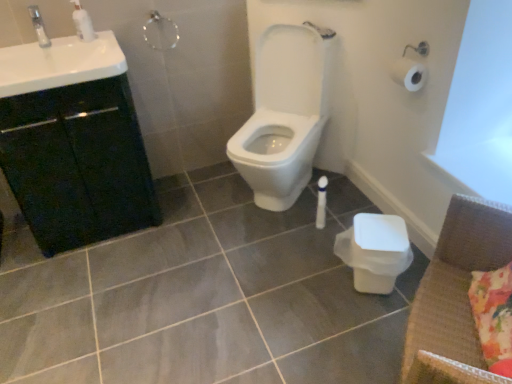
Where is `white glossy soap dispenser at upper left`? The width and height of the screenshot is (512, 384). white glossy soap dispenser at upper left is located at coordinates (82, 22).

Describe the element at coordinates (494, 316) in the screenshot. I see `fluffy floral pillow at lower right` at that location.

You are a GUI agent. You are given a task and a screenshot of the screen. Output one action in this format:
    pyautogui.click(x=<x>, y=<y>)
    Task: Click on the fluffy floral pillow at lower right
    
    Given the screenshot: What is the action you would take?
    click(494, 316)

This screenshot has height=384, width=512. What do you see at coordinates (375, 251) in the screenshot? I see `white plastic toilet bowl at lower right` at bounding box center [375, 251].

Locate an element on the screen. This screenshot has width=512, height=384. white plastic toilet bowl at lower right is located at coordinates (375, 251).

Image resolution: width=512 pixels, height=384 pixels. I want to click on brown woven armchair at lower right, so click(x=455, y=295).

Where is `white glossy toilet at center`? The width and height of the screenshot is (512, 384). white glossy toilet at center is located at coordinates (284, 114).

You are a GUI agent. You are given a task and a screenshot of the screen. Output one action in this format:
    pyautogui.click(x=<x>, y=<y>)
    Task: Click on the white glossy soap dispenser at upper left
    The image size is (512, 384).
    Given the screenshot: What is the action you would take?
    pyautogui.click(x=82, y=22)

What's the angular difference between black matte cabinet at left and white glossy toilet at center's facing directions?

50.7 degrees.

Does black matte cabinet at left have a greater height compared to white glossy toilet at center?

In fact, black matte cabinet at left may be shorter than white glossy toilet at center.

Choose the correct answer: Is black matte cabinet at left inside white glossy toilet at center or outside it?

black matte cabinet at left lies outside white glossy toilet at center.

From the image's perspective, which one is positioned higher, black matte cabinet at left or white glossy toilet at center?

white glossy toilet at center is shown above in the image.

From a real-world perspective, which object rests below the other?

From a 3D spatial view, black matte cabinet at left is below.

Is white glossy sink at upper left bigger than black matte cabinet at left?

Actually, white glossy sink at upper left might be smaller than black matte cabinet at left.

Between white glossy sink at upper left and black matte cabinet at left, which one appears on the left side from the viewer's perspective?

Positioned to the left is black matte cabinet at left.

Is white glossy sink at upper left not near black matte cabinet at left?

That's not correct — white glossy sink at upper left is a little close to black matte cabinet at left.

Is fluffy floral pillow at lower right at the back of white glossy soap dispenser at upper left?

No.

Which of these two, white glossy soap dispenser at upper left or fluffy floral pillow at lower right, stands shorter?

With less height is white glossy soap dispenser at upper left.

Is white glossy soap dispenser at upper left in contact with fluffy floral pillow at lower right?

No, white glossy soap dispenser at upper left is not in contact with fluffy floral pillow at lower right.

In terms of width, does white glossy soap dispenser at upper left look wider or thinner when compared to fluffy floral pillow at lower right?

Considering their sizes, white glossy soap dispenser at upper left looks slimmer than fluffy floral pillow at lower right.

Is black matte cabinet at left positioned in front of clear plastic faucet at upper left?

Yes.

Does black matte cabinet at left have a greater height compared to clear plastic faucet at upper left?

Correct, black matte cabinet at left is much taller as clear plastic faucet at upper left.

Is black matte cabinet at left next to clear plastic faucet at upper left and touching it?

No, black matte cabinet at left is not next to clear plastic faucet at upper left.

Is black matte cabinet at left aimed at clear plastic faucet at upper left?

No, black matte cabinet at left does not turn towards clear plastic faucet at upper left.

Is white glossy toilet at center wider than white plastic toilet bowl at lower right?

Correct, the width of white glossy toilet at center exceeds that of white plastic toilet bowl at lower right.

Based on the photo, between white glossy toilet at center and white plastic toilet bowl at lower right, which one has less height?

white plastic toilet bowl at lower right.

Is the surface of white glossy toilet at center in direct contact with white plastic toilet bowl at lower right?

No, white glossy toilet at center is not making contact with white plastic toilet bowl at lower right.

Considering the sizes of white glossy toilet at center and white plastic toilet bowl at lower right in the image, is white glossy toilet at center bigger or smaller than white plastic toilet bowl at lower right?

Clearly, white glossy toilet at center is larger in size than white plastic toilet bowl at lower right.

Which is behind, point (448, 286) or point (111, 44)?

Positioned behind is point (111, 44).

From a real-world perspective, which object rests below the other?

In real-world perspective, brown woven armchair at lower right is lower.

Which of these two, brown woven armchair at lower right or white glossy sink at upper left, is thinner?

Thinner between the two is brown woven armchair at lower right.

Based on the photo, is the depth of brown woven armchair at lower right greater than that of white glossy sink at upper left?

No, it is in front of white glossy sink at upper left.

Based on the photo, how distant is white glossy sink at upper left from brown woven armchair at lower right?

white glossy sink at upper left and brown woven armchair at lower right are 5.05 feet apart.

Which is closer to the camera, (42, 66) or (457, 352)?

The point (457, 352) is closer to the camera.

From the image's perspective, is white glossy sink at upper left over brown woven armchair at lower right?

Yes, from the image's perspective, white glossy sink at upper left is over brown woven armchair at lower right.

Considering the relative sizes of white glossy sink at upper left and brown woven armchair at lower right in the image provided, is white glossy sink at upper left shorter than brown woven armchair at lower right?

Indeed, white glossy sink at upper left has a lesser height compared to brown woven armchair at lower right.

I want to click on toilet that is above the black matte cabinet at left (from a real-world perspective), so click(284, 114).

Where is `sink lying on the right of black matte cabinet at left`? The image size is (512, 384). sink lying on the right of black matte cabinet at left is located at coordinates (59, 63).

When comparing their distances from white plastic toilet bowl at lower right, does fluffy floral pillow at lower right or brown woven armchair at lower right seem further?

fluffy floral pillow at lower right is positioned further to the anchor white plastic toilet bowl at lower right.

When comparing their distances from gray glossy tile at center, does brown woven armchair at lower right or clear plastic faucet at upper left seem further?

clear plastic faucet at upper left.

Estimate the real-world distances between objects in this image. Which object is closer to white glossy sink at upper left, black matte cabinet at left or white plastic toilet bowl at lower right?

Among the two, black matte cabinet at left is located nearer to white glossy sink at upper left.

From the image, which object appears to be farther from brown woven armchair at lower right, fluffy floral pillow at lower right or white glossy toilet at center?

white glossy toilet at center is further to brown woven armchair at lower right.

Based on their spatial positions, is fluffy floral pillow at lower right or white plastic toilet bowl at lower right further from white glossy soap dispenser at upper left?

fluffy floral pillow at lower right is positioned further to the anchor white glossy soap dispenser at upper left.

Estimate the real-world distances between objects in this image. Which object is closer to gray glossy tile at center, white plastic toilet bowl at lower right or brown woven armchair at lower right?

Among the two, white plastic toilet bowl at lower right is located nearer to gray glossy tile at center.

Estimate the real-world distances between objects in this image. Which object is closer to white glossy soap dispenser at upper left, clear plastic faucet at upper left or fluffy floral pillow at lower right?

clear plastic faucet at upper left is closer to white glossy soap dispenser at upper left.

Which object lies further to the anchor point clear plastic faucet at upper left, white glossy toilet at center or gray glossy tile at center?

Based on the image, gray glossy tile at center appears to be further to clear plastic faucet at upper left.

Image resolution: width=512 pixels, height=384 pixels. I want to click on bathroom cabinet between clear plastic faucet at upper left and brown woven armchair at lower right, so 77,163.

The width and height of the screenshot is (512, 384). What are the coordinates of `toilet bowl between white glossy sink at upper left and brown woven armchair at lower right in the horizontal direction` in the screenshot? It's located at (375, 251).

You are a GUI agent. You are given a task and a screenshot of the screen. Output one action in this format:
    pyautogui.click(x=<x>, y=<y>)
    Task: Click on the armchair between clear plastic faucet at upper left and fluffy floral pillow at lower right
    Image resolution: width=512 pixels, height=384 pixels.
    Given the screenshot: What is the action you would take?
    pyautogui.click(x=455, y=295)

At what (x,y) coordinates should I click in order to perform the action: click on toilet between black matte cabinet at left and fluffy floral pillow at lower right in the horizontal direction. Please return your answer as a coordinate pair (x, y). The height and width of the screenshot is (384, 512). Looking at the image, I should click on (284, 114).